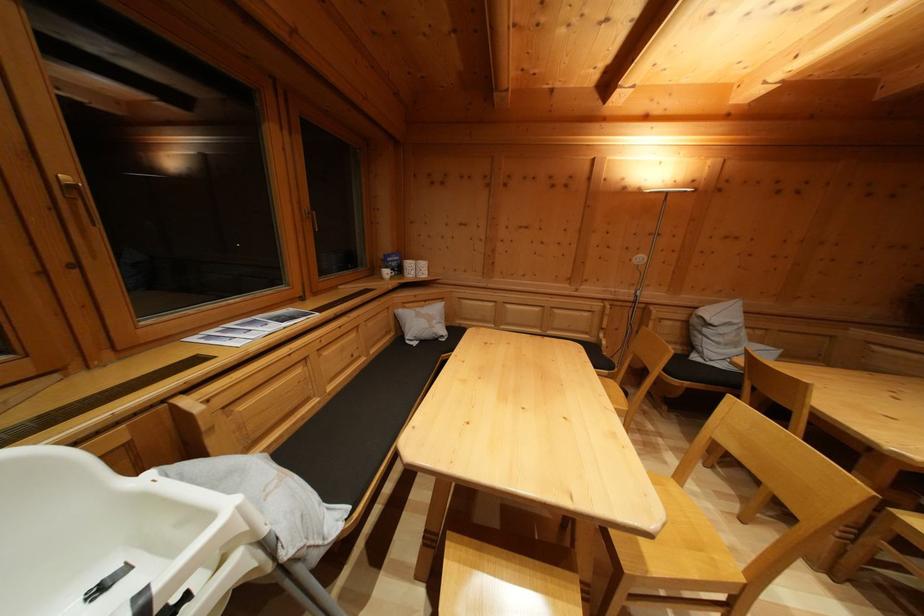
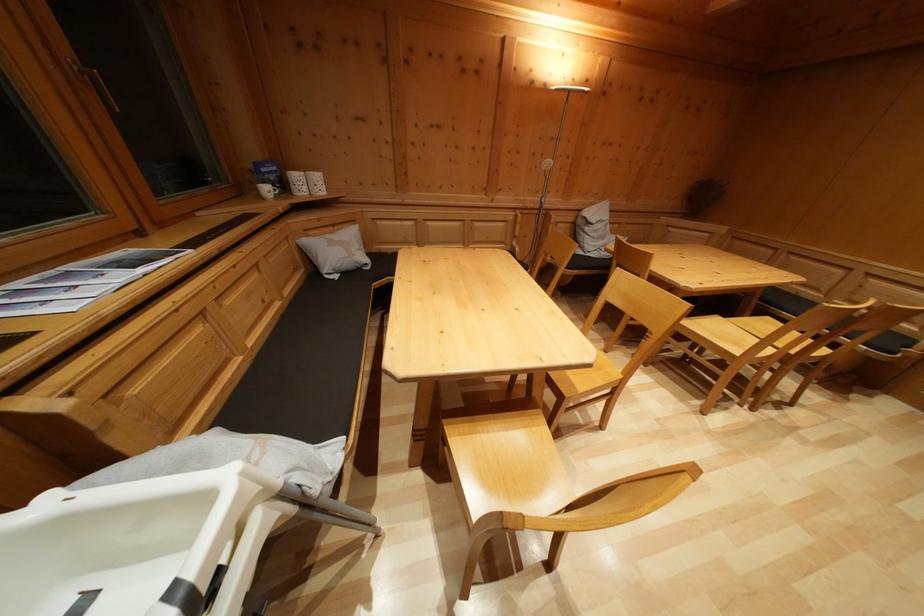
Find the pixel in the second image that matches (431,308) in the first image.

(338, 233)